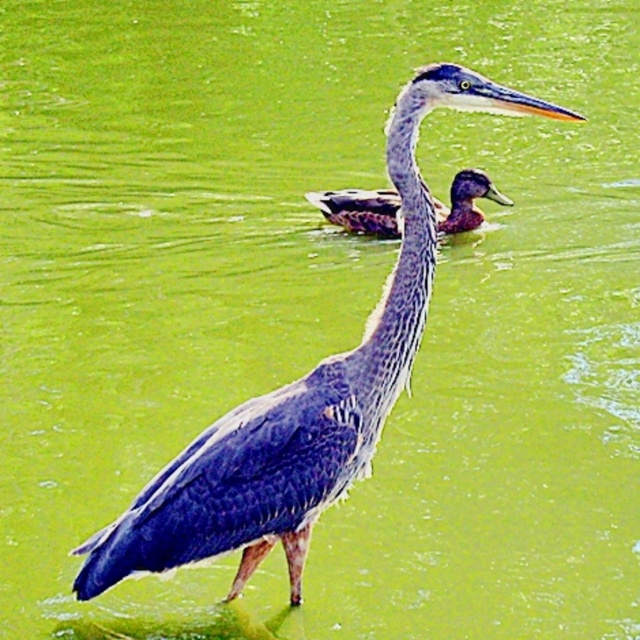
Question: Does blue feathered heron at center have a smaller size compared to greenish-brown feathers duck at center?

Choices:
 (A) yes
 (B) no

Answer: (B)

Question: Which object appears farthest from the camera in this image?

Choices:
 (A) greenish-brown feathers duck at center
 (B) blue feathered heron at center

Answer: (A)

Question: Does blue feathered heron at center appear on the right side of greenish-brown feathers duck at center?

Choices:
 (A) yes
 (B) no

Answer: (B)

Question: Is blue feathered heron at center wider than greenish-brown feathers duck at center?

Choices:
 (A) yes
 (B) no

Answer: (A)

Question: Which of the following is the closest to the observer?

Choices:
 (A) blue feathered heron at center
 (B) greenish-brown feathers duck at center

Answer: (A)